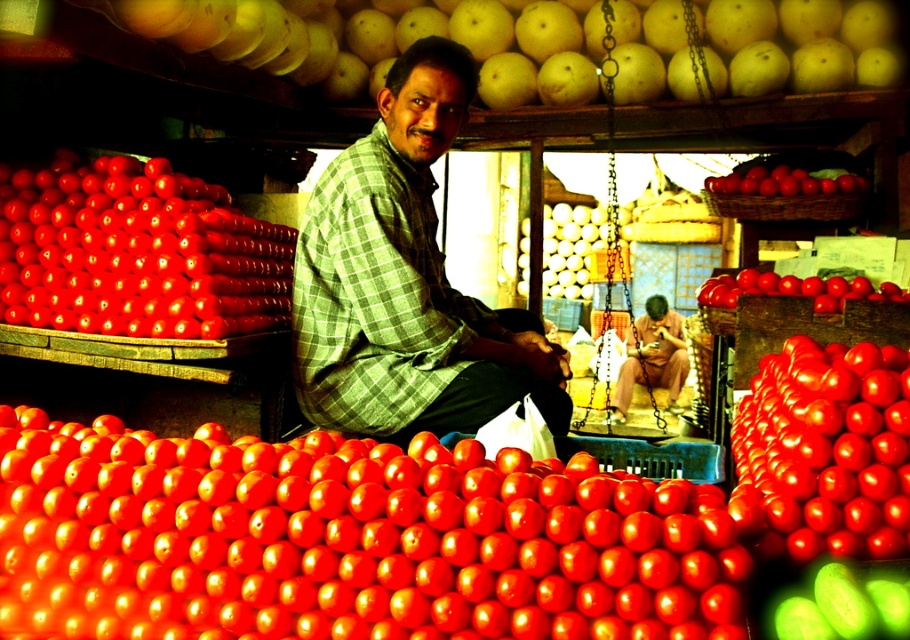
You are a customer at the fruit market holding a basket that can hold items up to 2 meters in length. You want to place both the glossy red tomato at center and the smooth yellow pomelo at upper center into the basket. Can the basket accommodate both items without exceeding its length capacity?

The distance between the glossy red tomato at center and the smooth yellow pomelo at upper center is 2.49 meters, which exceeds the basket capacity of 2 meters. Therefore, the basket cannot accommodate both items without exceeding its length capacity.

You are a customer at the fruit market and want to buy the shiny red tomato at lower left and the matte green shirt at center. However, you can only reach items within your immediate vicinity. Based on their positions, which item is closer to your current position?

The shiny red tomato at lower left is closer to your current position because it is positioned to the left of the matte green shirt at center, which is further away in the scene.

You are standing in the fruit market and want to locate the green checkered shirt at center. Based on the coordinates provided, where would you look to find it?

The green checkered shirt at center is located at the 2D coordinates point (403, 282).